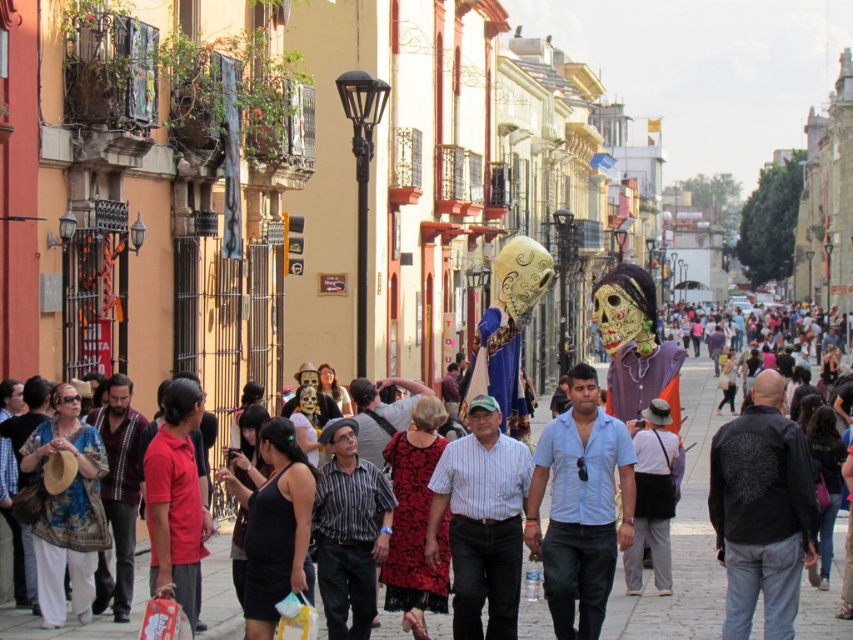
Question: Can you confirm if red floral dress at center is bigger than denim jacket at lower right?

Choices:
 (A) no
 (B) yes

Answer: (A)

Question: Estimate the real-world distances between objects in this image. Which object is farther from the red floral dress at center?

Choices:
 (A) gray cotton pants at center
 (B) paved stone street at center
 (C) red matte shirt at center

Answer: (B)

Question: Is blue striped shirt at center positioned at the back of red matte shirt at center?

Choices:
 (A) yes
 (B) no

Answer: (A)

Question: Which point appears farthest from the camera in this image?

Choices:
 (A) (403, 608)
 (B) (838, 397)

Answer: (B)

Question: Is paved stone street at center below blue striped shirt at center?

Choices:
 (A) no
 (B) yes

Answer: (B)

Question: Which object appears farthest from the camera in this image?

Choices:
 (A) gray cotton pants at center
 (B) red floral dress at center
 (C) patterned fabric hat at lower left

Answer: (A)